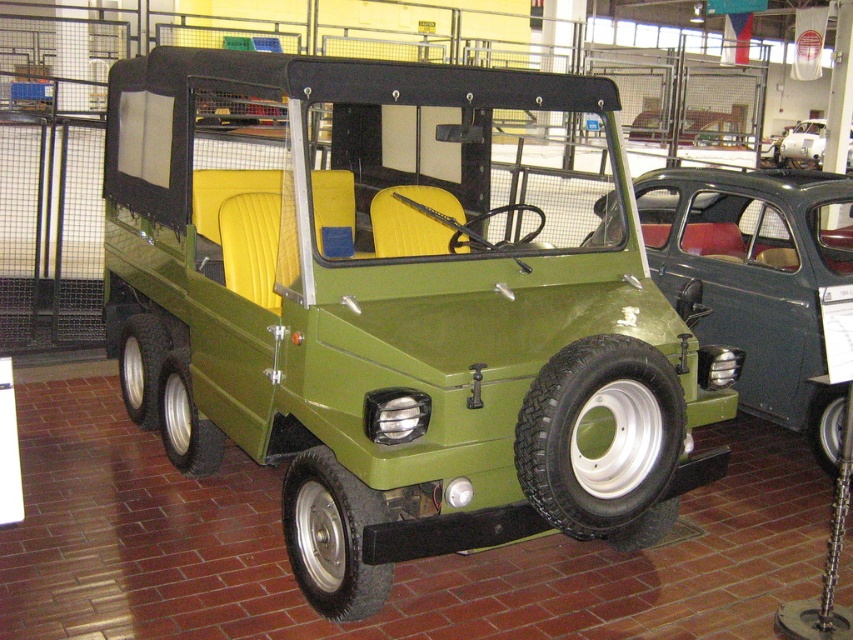
Is green matte truck at center further to the viewer compared to metallic silver car at center?

No, green matte truck at center is in front of metallic silver car at center.

Who is taller, green matte truck at center or metallic silver car at center?

With more height is green matte truck at center.

Is point (722, 275) more distant than point (813, 164)?

No.

You are a GUI agent. You are given a task and a screenshot of the screen. Output one action in this format:
    pyautogui.click(x=<x>, y=<y>)
    Task: Click on the green matte truck at center
    The image size is (853, 640).
    Given the screenshot: What is the action you would take?
    pyautogui.click(x=758, y=278)

Based on the photo, can you confirm if green matte pickup truck at center is bigger than metallic silver car at center?

Indeed, green matte pickup truck at center has a larger size compared to metallic silver car at center.

Is green matte pickup truck at center further to the viewer compared to metallic silver car at center?

That is False.

This screenshot has height=640, width=853. Find the location of `green matte pickup truck at center`. green matte pickup truck at center is located at coordinates (398, 305).

Image resolution: width=853 pixels, height=640 pixels. In order to click on green matte pickup truck at center in this screenshot , I will do `click(398, 305)`.

Between point (410, 86) and point (666, 268), which one is positioned in front?

Positioned in front is point (410, 86).

Looking at this image, between green matte pickup truck at center and green matte truck at center, which one is positioned higher?

Positioned higher is green matte truck at center.

You are a GUI agent. You are given a task and a screenshot of the screen. Output one action in this format:
    pyautogui.click(x=<x>, y=<y>)
    Task: Click on the green matte pickup truck at center
    
    Given the screenshot: What is the action you would take?
    pyautogui.click(x=398, y=305)

Find the location of `green matte pickup truck at center`. green matte pickup truck at center is located at coordinates (398, 305).